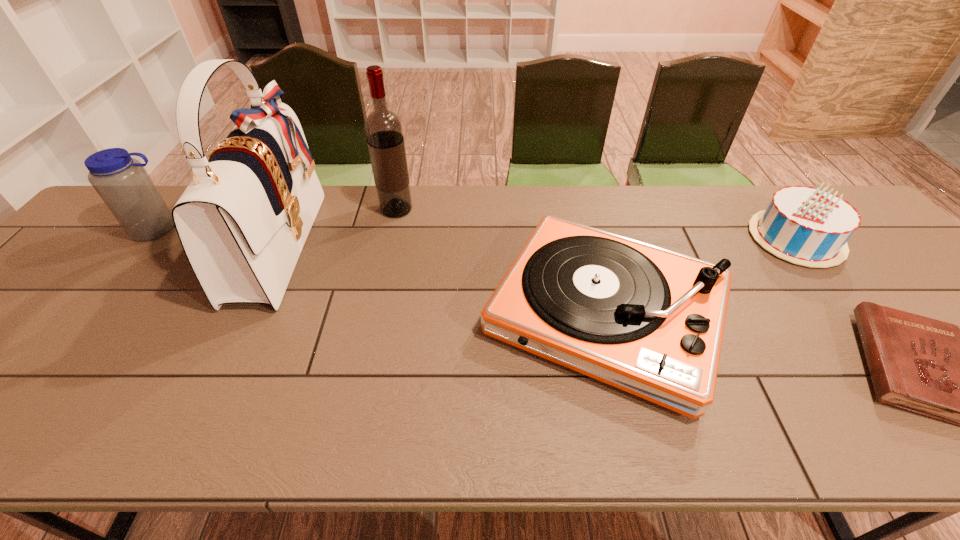
Where is `object that is the fourth closest to the satchel`? This screenshot has height=540, width=960. object that is the fourth closest to the satchel is located at coordinates 806,226.

At what (x,y) coordinates should I click in order to perform the action: click on free location that satisfies the following two spatial constraints: 1. on the front side of the birthday cake; 2. on the left side of the third object from left to right. Please return your answer as a coordinate pair (x, y). Looking at the image, I should click on (391, 239).

Image resolution: width=960 pixels, height=540 pixels. What are the coordinates of `vacant position in the image that satisfies the following two spatial constraints: 1. with a carrying loop on the side of the birthday cake; 2. on the right side of the water bottle` in the screenshot? It's located at (151, 239).